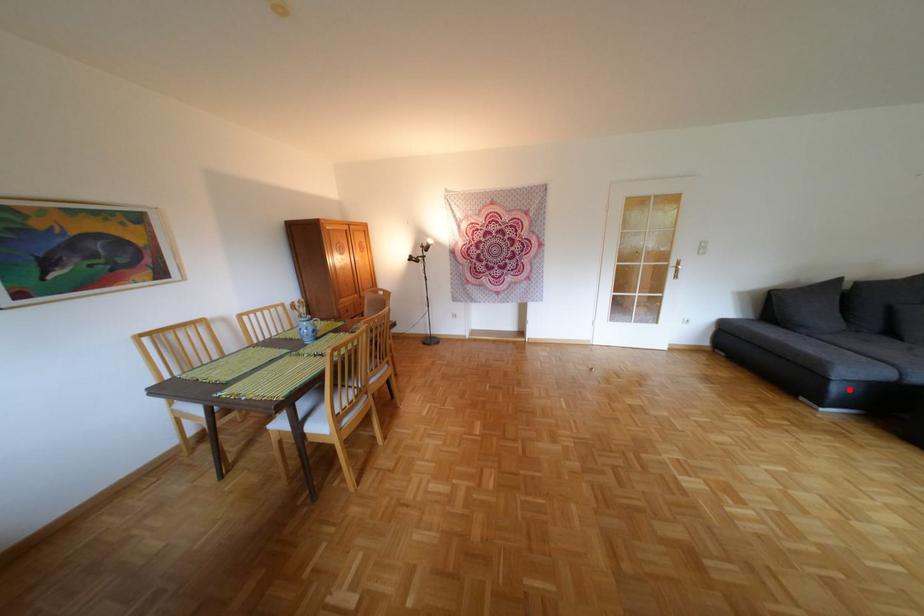
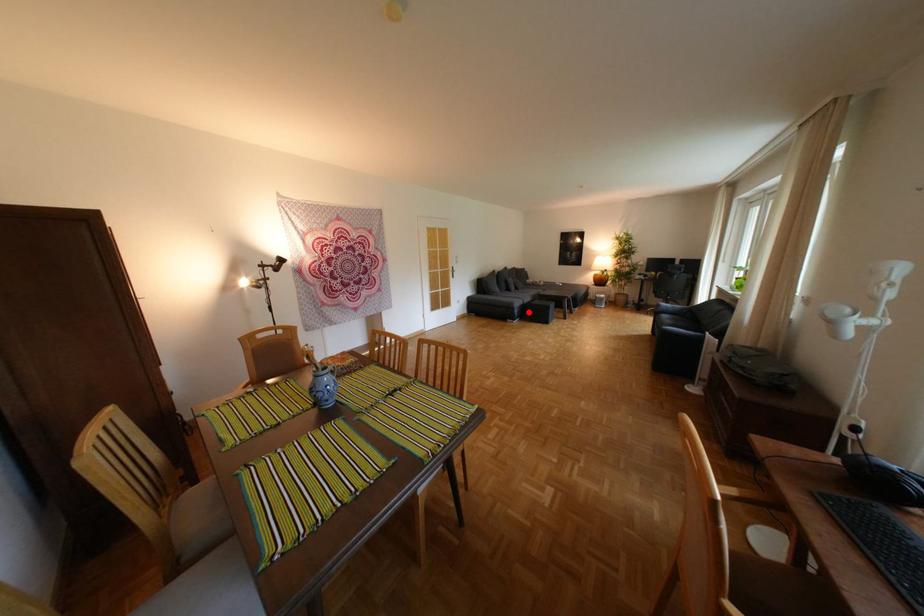
I am providing you with two images of the same scene from different viewpoints. A red point is marked on the first image and another point is marked on the second image. Do the highlighted points in image1 and image2 indicate the same real-world spot?

Yes